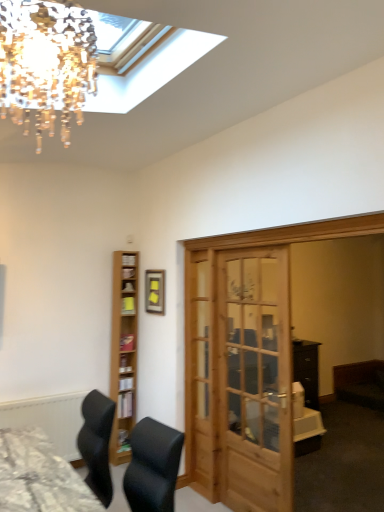
Question: Relative to textured gray desk at lower left, is light brown wooden shelf at left in front or behind?

Choices:
 (A) behind
 (B) front

Answer: (A)

Question: Is light brown wooden shelf at left spatially inside textured gray desk at lower left, or outside of it?

Choices:
 (A) outside
 (B) inside

Answer: (A)

Question: Estimate the real-world distances between objects in this image. Which object is farther from the textured gray desk at lower left?

Choices:
 (A) light brown wooden shelf at left
 (B) matte black picture frame at center
 (C) crystal glass chandelier at upper left
 (D) wooden door at center

Answer: (C)

Question: Based on their relative distances, which object is farther from the textured gray desk at lower left?

Choices:
 (A) matte black picture frame at center
 (B) light brown wooden shelf at left
 (C) crystal glass chandelier at upper left
 (D) wooden door at center

Answer: (C)